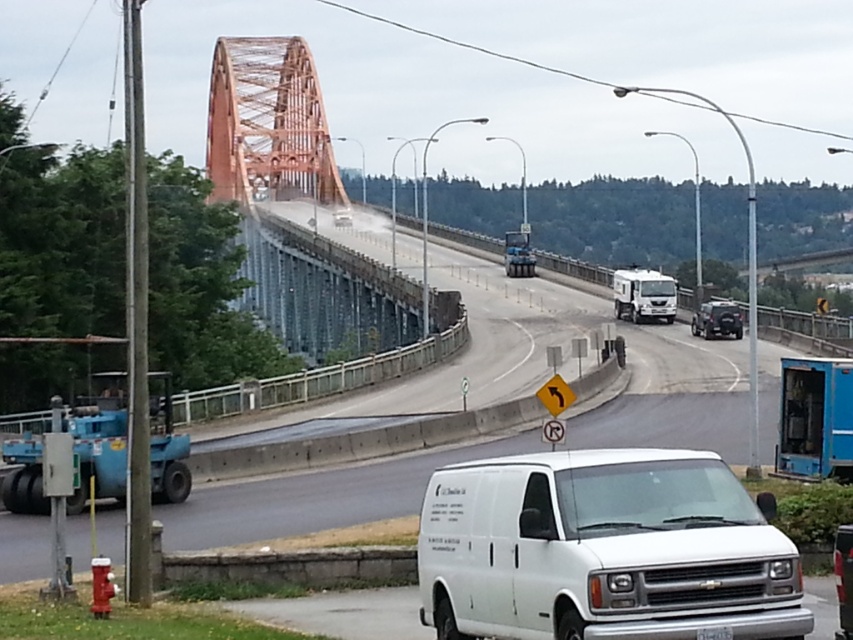
Question: Estimate the real-world distances between objects in this image. Which object is closer to the white matte truck at center?

Choices:
 (A) blue metallic trailer truck at right
 (B) orange metallic bridge at upper center
 (C) shiny black car at center

Answer: (C)

Question: Which point is farther from the camera taking this photo?

Choices:
 (A) (755, 593)
 (B) (734, 324)
 (C) (728, 353)

Answer: (B)

Question: Is white glossy van at center behind blue metallic truck at center?

Choices:
 (A) no
 (B) yes

Answer: (A)

Question: Can you confirm if blue metallic trailer truck at right is positioned above shiny black car at center?

Choices:
 (A) yes
 (B) no

Answer: (B)

Question: Does orange metallic bridge at upper center appear on the right side of blue metallic truck at center?

Choices:
 (A) yes
 (B) no

Answer: (B)

Question: Considering the real-world distances, which object is closest to the blue metallic trailer truck at right?

Choices:
 (A) shiny black car at center
 (B) white matte truck at center

Answer: (A)